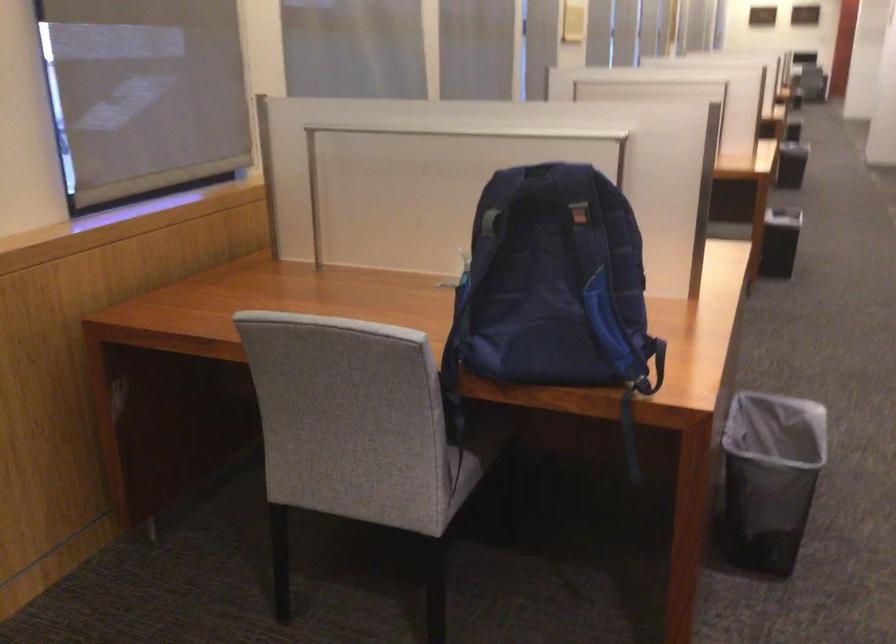
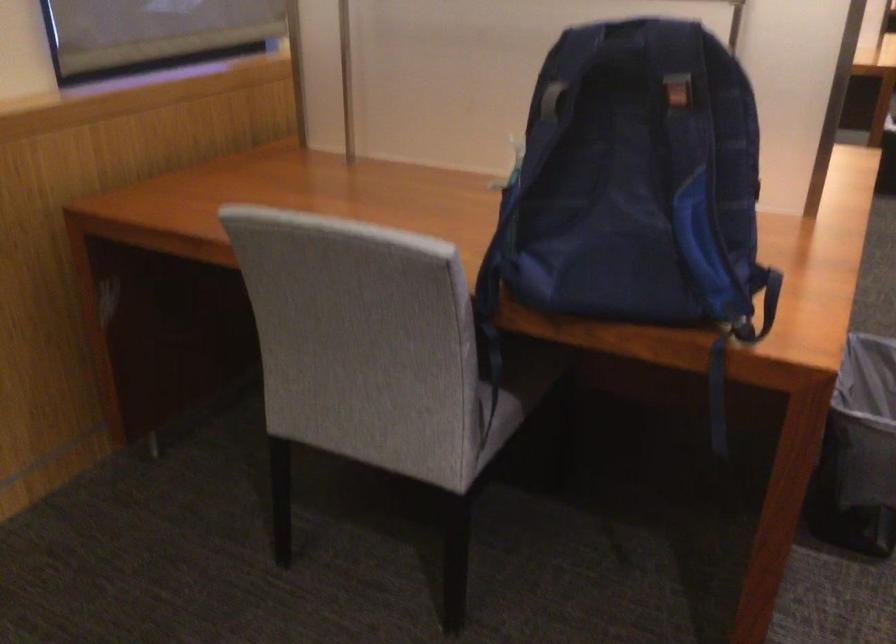
Find the pixel in the second image that matches [579,214] in the first image.

(677, 93)